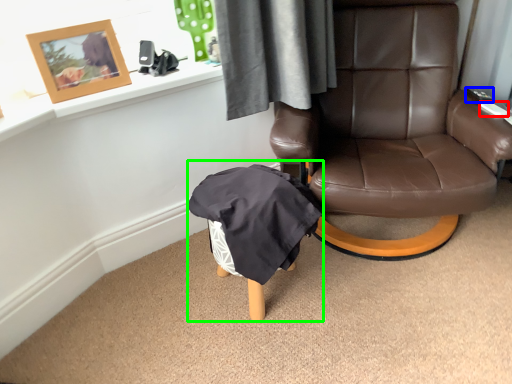
Question: Estimate the real-world distances between objects in this image. Which object is farther from remote control (highlighted by a red box), remote control (highlighted by a blue box) or bean bag chair (highlighted by a green box)?

Choices:
 (A) remote control
 (B) bean bag chair

Answer: (B)